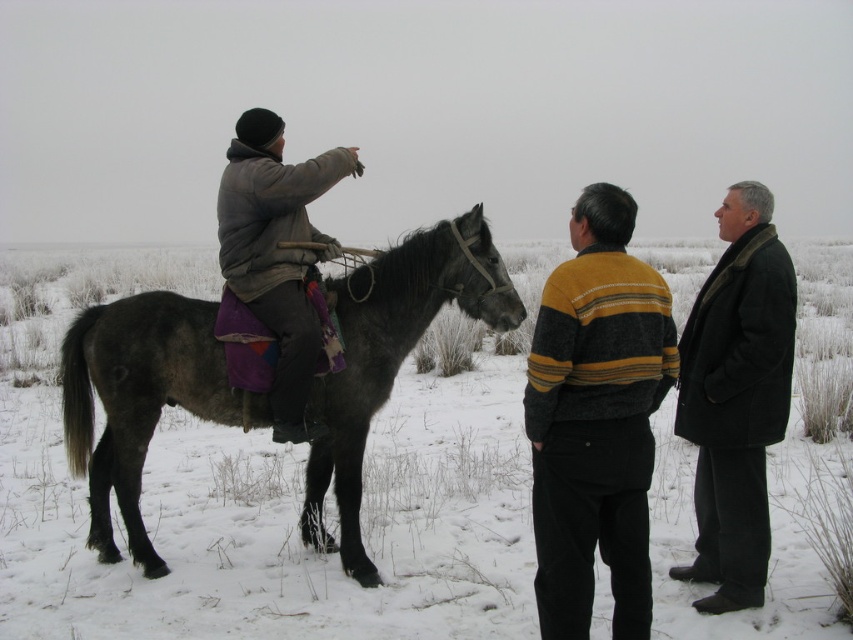
You are standing in a snowy field and see the dark gray fur horse at left. If you want to throw a snowball to hit the horse, and you can throw a snowball 5 meters, will you be able to hit the horse?

The dark gray fur horse at left and viewer are 4.87 meters apart, so yes, you can throw a snowball 5 meters to hit the horse since the distance is within your throwing range.

Looking at this image, you are standing in the snowy field and want to walk from point A to point B. Point A is at coordinate point(70, 468) and point B is at coordinate point(550, 428). Which point is closer to you?

Point A at coordinate point(70, 468) is closer to you because it is further to the viewer than point B at coordinate point(550, 428).

You are a photographer planning to take a portrait of the two people in the snowy field. You want to ensure both the dark gray wool coat at right and the gray woolen jacket at left are clearly visible in the photo. Which person should you position closer to the camera to avoid one blocking the other?

You should position the dark gray wool coat at right closer to the camera because it is already in front of the gray woolen jacket at left. This will ensure both are visible without one blocking the other.